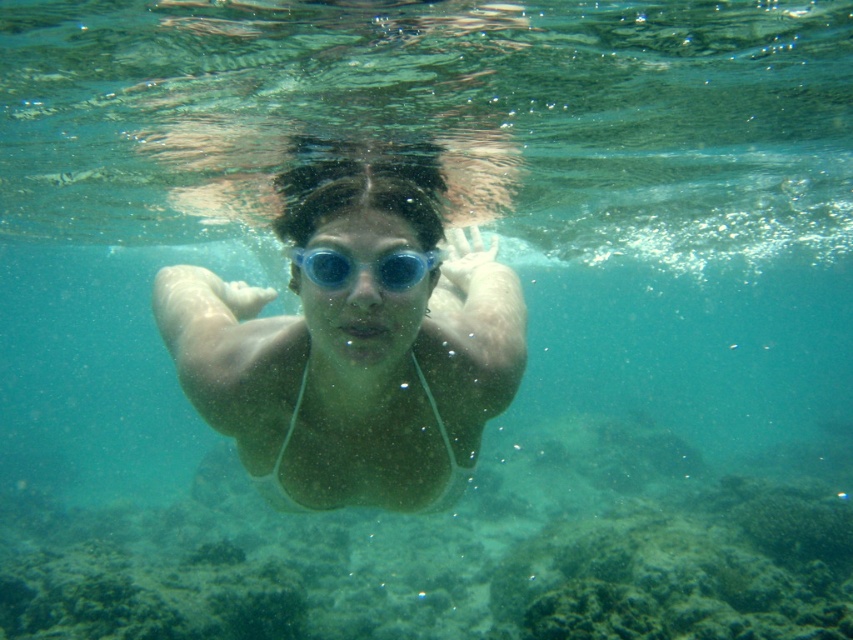
Question: Is matte blue goggles at center smaller than blue translucent goggles at center?

Choices:
 (A) no
 (B) yes

Answer: (A)

Question: Does matte blue goggles at center have a greater width compared to blue translucent goggles at center?

Choices:
 (A) yes
 (B) no

Answer: (A)

Question: Can you confirm if matte blue goggles at center is positioned to the right of blue translucent goggles at center?

Choices:
 (A) yes
 (B) no

Answer: (B)

Question: Which point appears closest to the camera in this image?

Choices:
 (A) (415, 273)
 (B) (416, 497)

Answer: (A)